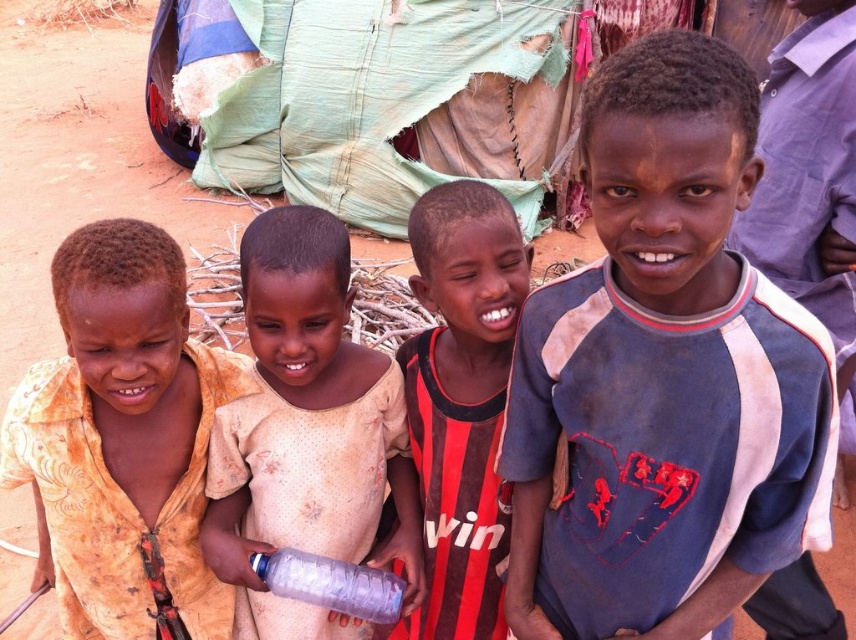
Question: Can you confirm if blue cotton shirt at center is positioned below transparent plastic bottle at lower center?

Choices:
 (A) yes
 (B) no

Answer: (B)

Question: Is blue cotton shirt at center above light brown fabric shirt at center?

Choices:
 (A) yes
 (B) no

Answer: (A)

Question: Which object is farther from the camera taking this photo?

Choices:
 (A) red and black striped shirt at center
 (B) blue cotton shirt at center

Answer: (A)

Question: Which point is farther from the camera taking this photo?

Choices:
 (A) (589, 189)
 (B) (191, 616)

Answer: (B)

Question: Which of the following is the closest to the observer?

Choices:
 (A) yellow cotton shirt at left
 (B) transparent plastic bottle at lower center
 (C) light brown fabric shirt at center

Answer: (A)

Question: Does yellow cotton shirt at left appear over light brown fabric shirt at center?

Choices:
 (A) no
 (B) yes

Answer: (B)